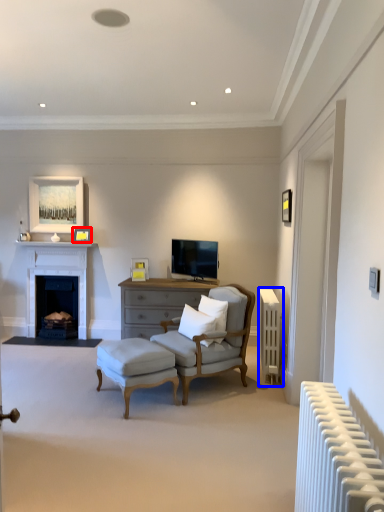
Question: Which object appears closest to the camera in this image, picture frame (highlighted by a red box) or radiator (highlighted by a blue box)?

Choices:
 (A) picture frame
 (B) radiator

Answer: (B)